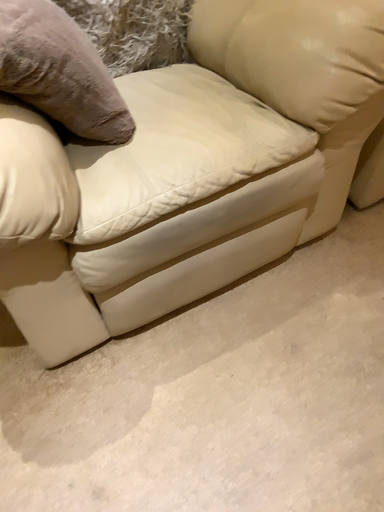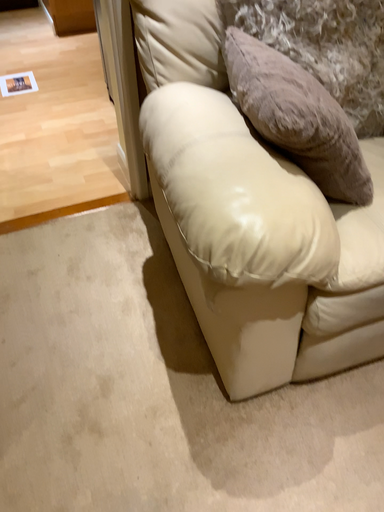
Question: How did the camera likely rotate when shooting the video?

Choices:
 (A) rotated downward
 (B) rotated upward

Answer: (B)